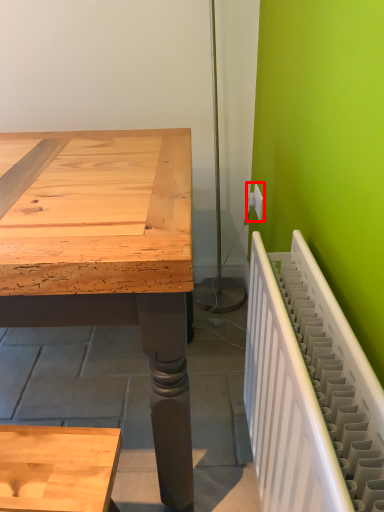
Question: In this image, where is electric outlet (annotated by the red box) located relative to radiator?

Choices:
 (A) left
 (B) right

Answer: (B)